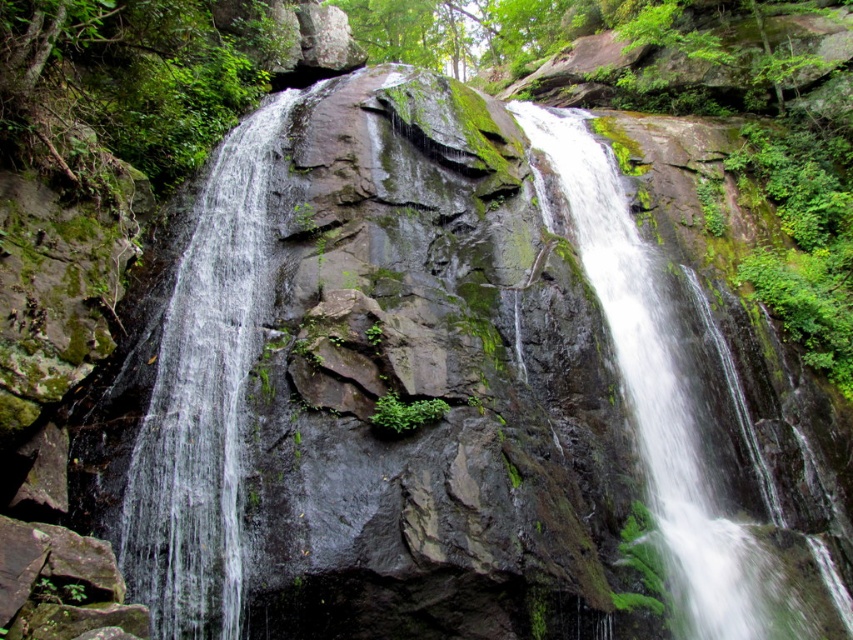
Who is more distant from viewer, (247, 288) or (610, 236)?

The point (610, 236) is behind.

Who is positioned more to the left, clear water at center or green mossy rock at center?

Positioned to the left is clear water at center.

What do you see at coordinates (204, 397) in the screenshot? This screenshot has height=640, width=853. I see `clear water at center` at bounding box center [204, 397].

The width and height of the screenshot is (853, 640). Find the location of `clear water at center`. clear water at center is located at coordinates pyautogui.click(x=204, y=397).